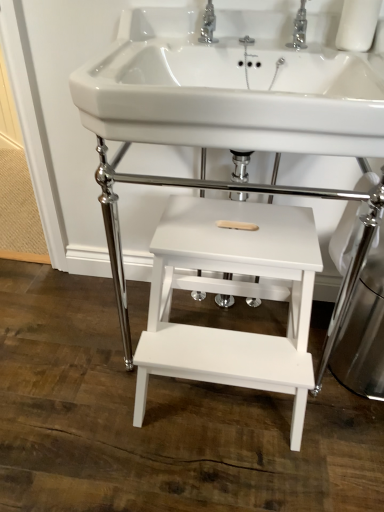
Question: From a real-world perspective, is white wood step stool at center, the second table when ordered from top to bottom, physically above polished chrome tap at upper center, the 2th tap when ordered from right to left?

Choices:
 (A) no
 (B) yes

Answer: (A)

Question: From a real-world perspective, does white wood step stool at center, which appears as the first table when ordered from the bottom, sit lower than polished chrome tap at upper center, the 2th tap when ordered from right to left?

Choices:
 (A) no
 (B) yes

Answer: (B)

Question: Is white wood step stool at center, which appears as the first table when ordered from the bottom, positioned beyond the bounds of polished chrome tap at upper center, the 2th tap when ordered from right to left?

Choices:
 (A) yes
 (B) no

Answer: (A)

Question: Is white wood step stool at center, which appears as the first table when ordered from the bottom, smaller than polished chrome tap at upper center, arranged as the 1th tap when viewed from the left?

Choices:
 (A) no
 (B) yes

Answer: (A)

Question: Is white wood step stool at center, which appears as the first table when ordered from the bottom, in front of polished chrome tap at upper center, arranged as the 1th tap when viewed from the left?

Choices:
 (A) yes
 (B) no

Answer: (A)

Question: Is white wood step stool at center, the second table when ordered from top to bottom, bigger than polished chrome tap at upper center, the 2th tap when ordered from right to left?

Choices:
 (A) no
 (B) yes

Answer: (B)

Question: Does white glossy sink at center have a greater height compared to polished chrome tap at upper center, arranged as the 1th tap when viewed from the left?

Choices:
 (A) yes
 (B) no

Answer: (A)

Question: Is white glossy sink at center behind polished chrome tap at upper center, the 2th tap when ordered from right to left?

Choices:
 (A) no
 (B) yes

Answer: (A)

Question: Does white glossy sink at center appear on the right side of polished chrome tap at upper center, the 2th tap when ordered from right to left?

Choices:
 (A) yes
 (B) no

Answer: (A)

Question: From the image's perspective, is white glossy sink at center under polished chrome tap at upper center, arranged as the 1th tap when viewed from the left?

Choices:
 (A) yes
 (B) no

Answer: (A)

Question: Considering the relative positions of white glossy sink at center and polished chrome tap at upper center, the 2th tap when ordered from right to left, in the image provided, is white glossy sink at center in front of polished chrome tap at upper center, the 2th tap when ordered from right to left,?

Choices:
 (A) no
 (B) yes

Answer: (B)

Question: Is polished chrome tap at upper center, the 2th tap when ordered from right to left, surrounded by white glossy sink at center?

Choices:
 (A) yes
 (B) no

Answer: (A)

Question: From the image's perspective, does white matte wood step stool at center, which is the 1th table from top to bottom, appear higher than white glossy sink at center?

Choices:
 (A) no
 (B) yes

Answer: (A)